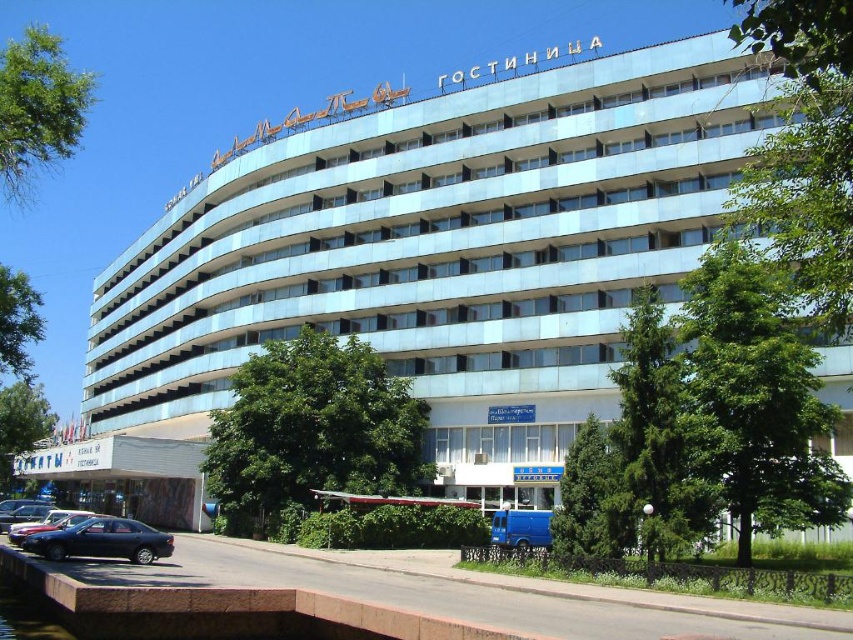
You are a parking attendant at the hotel and need to park both the matte black sedan at lower left and the metallic blue sedan at lower left. Since the parking spot is narrow, which car should you park first to ensure both can fit?

The matte black sedan at lower left should be parked first because it occupies less space than the metallic blue sedan at lower left, allowing both to fit in the narrow parking spot.

Consider the image. You are standing at the entrance of the hotel and want to locate the matte black sedan at lower left. According to the coordinates provided, where exactly should you look to find it?

The matte black sedan at lower left is located at point (102, 540), so you should look towards the lower left area near those coordinates to find it.